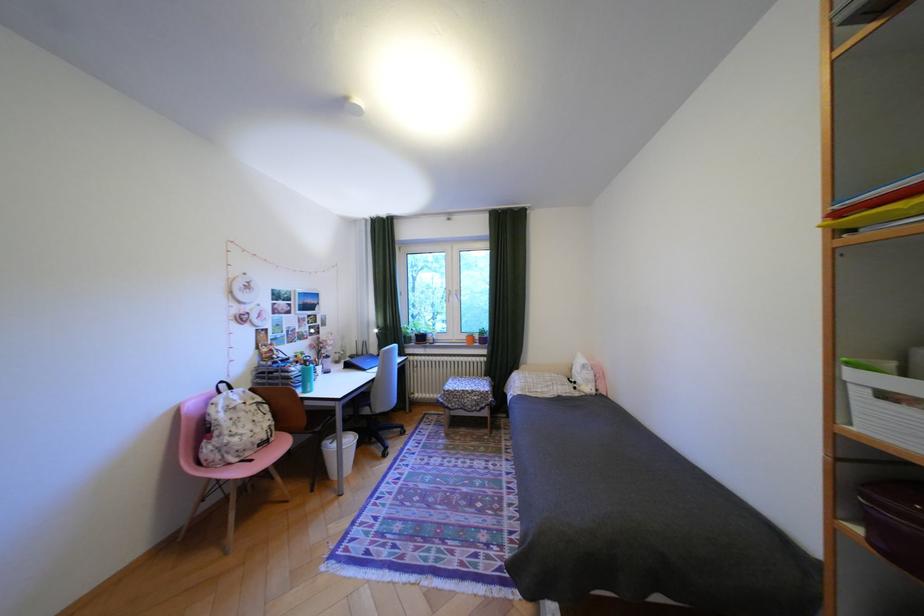
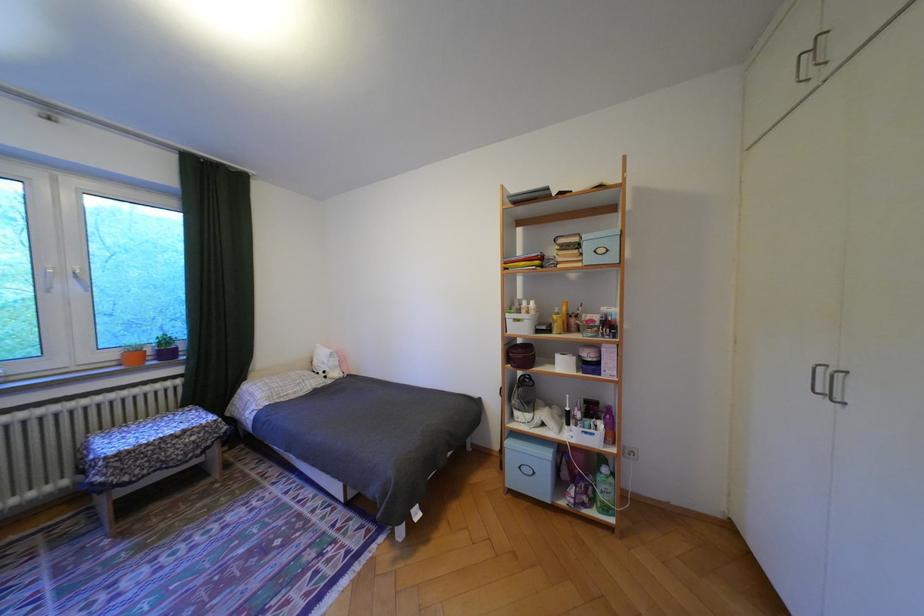
The point at (494, 341) is marked in the first image. Where is the corresponding point in the second image?

(178, 354)